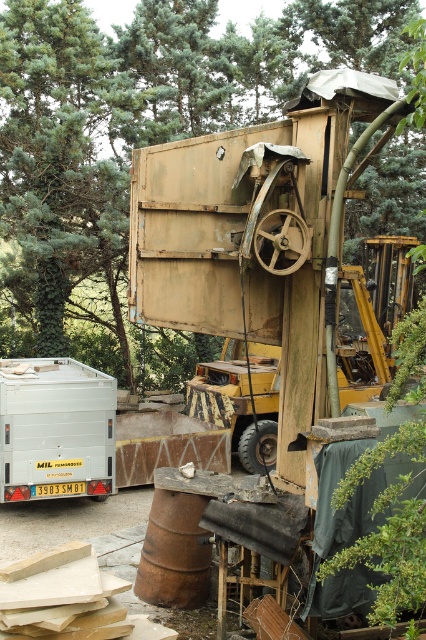
What do you see at coordinates (60, 163) in the screenshot? Image resolution: width=426 pixels, height=640 pixels. I see `green leafy tree at upper left` at bounding box center [60, 163].

Image resolution: width=426 pixels, height=640 pixels. I want to click on green leafy tree at upper left, so click(60, 163).

Does point (3, 61) come closer to viewer compared to point (51, 400)?

No, it is behind (51, 400).

Can you confirm if green leafy tree at upper center is positioned below white matte trailer at lower left?

Actually, green leafy tree at upper center is above white matte trailer at lower left.

Does point (276, 36) come in front of point (71, 362)?

That is False.

The width and height of the screenshot is (426, 640). I want to click on green leafy tree at upper center, so click(x=138, y=141).

Is green leafy tree at upper center behind green leafy tree at upper left?

That is False.

Which is more to the right, green leafy tree at upper center or green leafy tree at upper left?

green leafy tree at upper center

Does point (19, 323) lie in front of point (29, 317)?

No, (19, 323) is behind (29, 317).

Identify the location of green leafy tree at upper center. (138, 141).